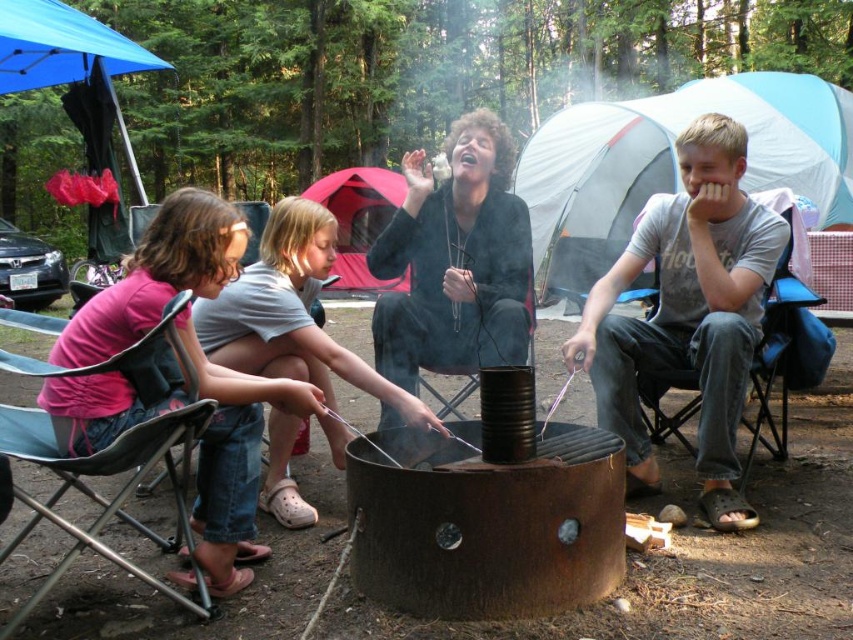
Question: Where is white fabric tent at upper center located in relation to teal fabric chair at lower left in the image?

Choices:
 (A) above
 (B) below

Answer: (A)

Question: Which of the following is the closest to the observer?

Choices:
 (A) matte black grill at center
 (B) denim shorts at center
 (C) black matte jacket at center
 (D) red fabric tent at center

Answer: (B)

Question: Does gray cotton t-shirt at center have a smaller size compared to teal fabric chair at lower left?

Choices:
 (A) no
 (B) yes

Answer: (A)

Question: Among these points, which one is nearest to the camera?

Choices:
 (A) (640, 483)
 (B) (343, 248)
 (C) (10, 433)

Answer: (C)

Question: Which is farther from the teal fabric chair at lower left?

Choices:
 (A) white fabric tent at upper center
 (B) black matte jacket at center

Answer: (A)

Question: Can you confirm if gray cotton t-shirt at center is positioned below black matte jacket at center?

Choices:
 (A) yes
 (B) no

Answer: (A)